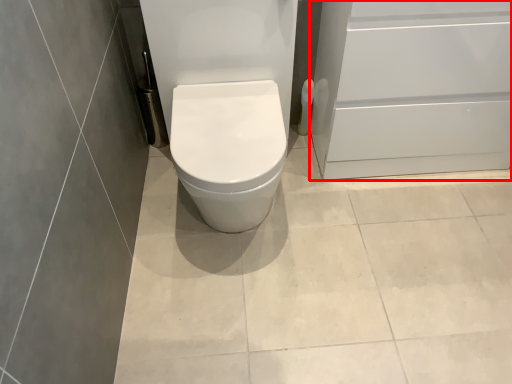
Question: From the image's perspective, where is screen door (annotated by the red box) located relative to toilet paper?

Choices:
 (A) below
 (B) above

Answer: (B)